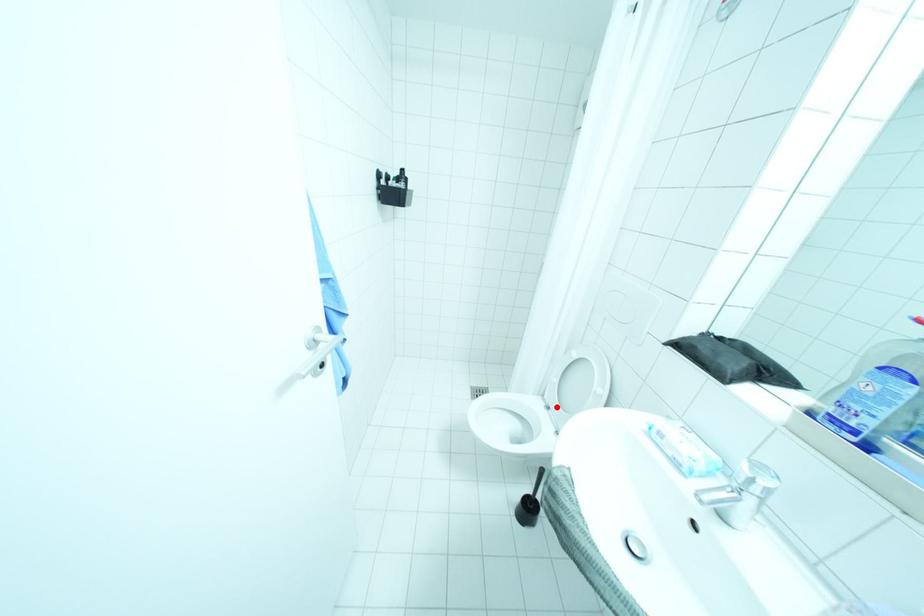
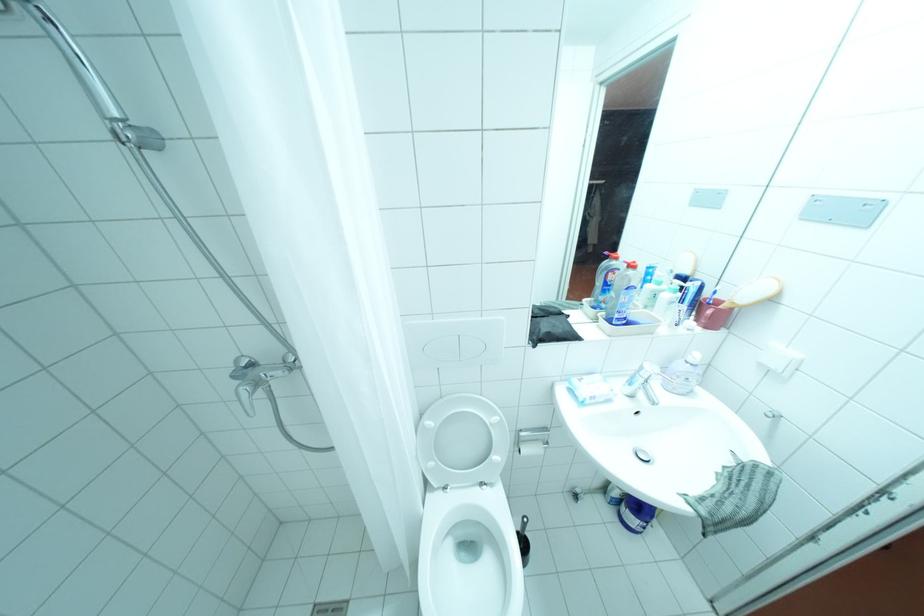
Locate, in the second image, the point that corresponds to the highlighted location in the first image.

(455, 487)